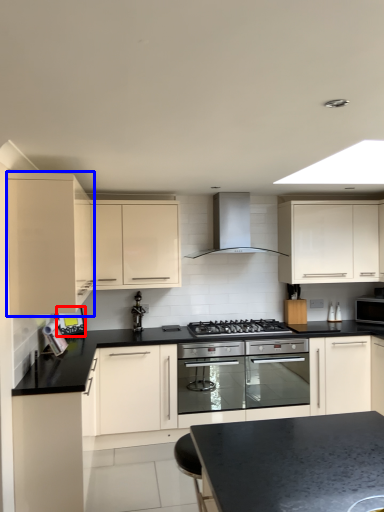
Question: Which object appears closest to the camera in this image, appliance (highlighted by a red box) or cabinetry (highlighted by a blue box)?

Choices:
 (A) appliance
 (B) cabinetry

Answer: (B)